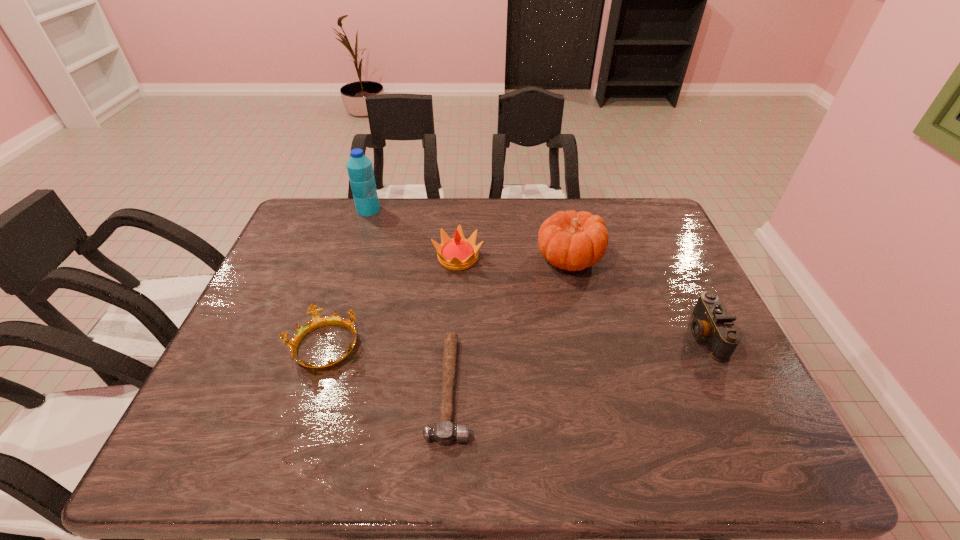
You are a GUI agent. You are given a task and a screenshot of the screen. Output one action in this format:
    pyautogui.click(x=<x>, y=<y>)
    Task: Click on the hammer
    The image size is (960, 540).
    Given the screenshot: What is the action you would take?
    pyautogui.click(x=444, y=432)

Image resolution: width=960 pixels, height=540 pixels. What are the coordinates of `free space located 0.080m on the front of the farthest object` in the screenshot? It's located at (361, 231).

The image size is (960, 540). What are the coordinates of `vacant space located on the left of the pumpkin` in the screenshot? It's located at (519, 258).

Find the location of `free space located 0.380m on the right of the right crown`. free space located 0.380m on the right of the right crown is located at coordinates [610, 258].

This screenshot has height=540, width=960. Identify the location of vacant space located on the lens of the third shortest object. (x=612, y=335).

This screenshot has height=540, width=960. Find the location of `free point located on the lens of the third shortest object`. free point located on the lens of the third shortest object is located at coordinates (529, 335).

At what (x,y) coordinates should I click in order to perform the action: click on vacant space located 0.070m on the lens of the third shortest object. Please return your answer as a coordinate pair (x, y). The image size is (960, 540). Looking at the image, I should click on (660, 335).

Where is `vacant area situated 0.100m on the back of the second shortest object`? vacant area situated 0.100m on the back of the second shortest object is located at coordinates point(342,294).

The width and height of the screenshot is (960, 540). What are the coordinates of `vacant space located on the striking face of the hammer` in the screenshot? It's located at (537, 387).

Where is `water bottle that is positioned at the far edge`? This screenshot has width=960, height=540. water bottle that is positioned at the far edge is located at coordinates (360, 170).